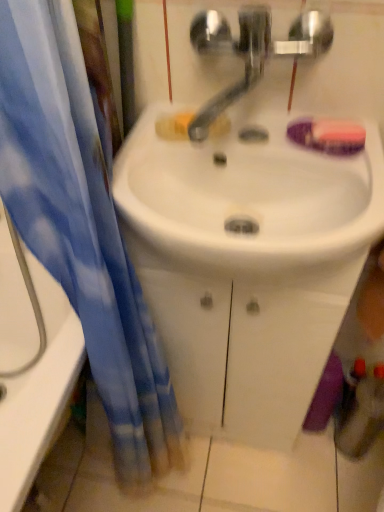
Question: Is point (72, 338) closer or farther from the camera than point (84, 59)?

Choices:
 (A) farther
 (B) closer

Answer: (A)

Question: From the image's perspective, relative to blue fabric curtain at left, is white glossy bathtub at left above or below?

Choices:
 (A) below
 (B) above

Answer: (B)

Question: Estimate the real-world distances between objects in this image. Which object is closer to the purple matte soap at upper right?

Choices:
 (A) satin nickel faucet at center
 (B) white glossy bathtub at left
 (C) blue fabric curtain at left
 (D) white glossy sink at center

Answer: (A)

Question: Estimate the real-world distances between objects in this image. Which object is farther from the white glossy sink at center?

Choices:
 (A) white glossy bathtub at left
 (B) satin nickel faucet at center
 (C) purple matte soap at upper right
 (D) blue fabric curtain at left

Answer: (A)